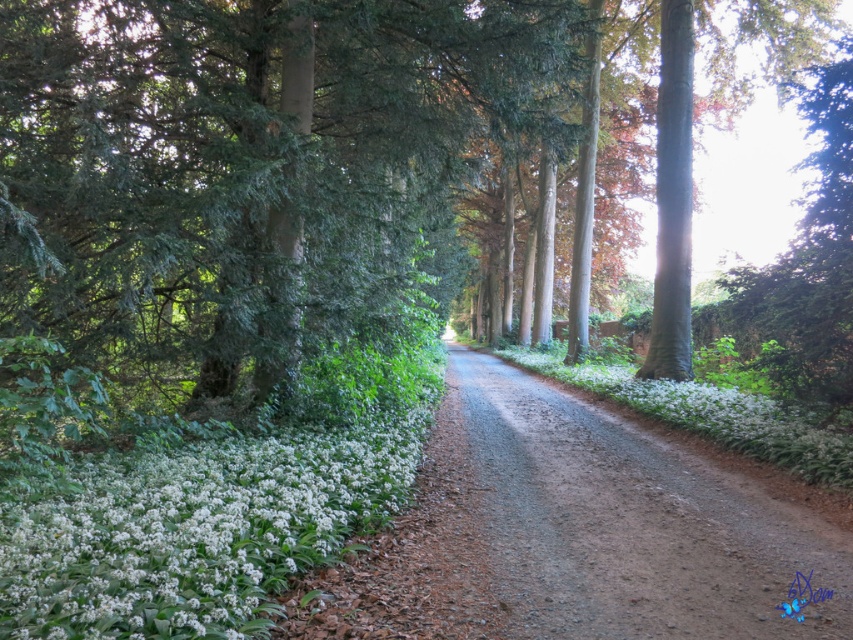
You are a hiker carrying a backpack and want to take a photo of the green textured tree at center and the white matte flowers at lower left. Which object is wider when viewed from your current position?

The green textured tree at center is wider than the white matte flowers at lower left.